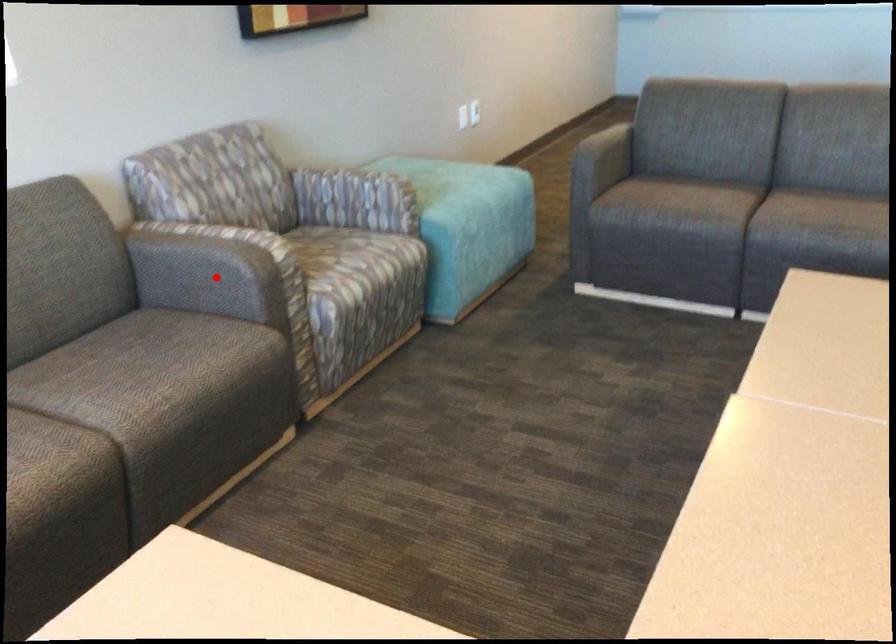
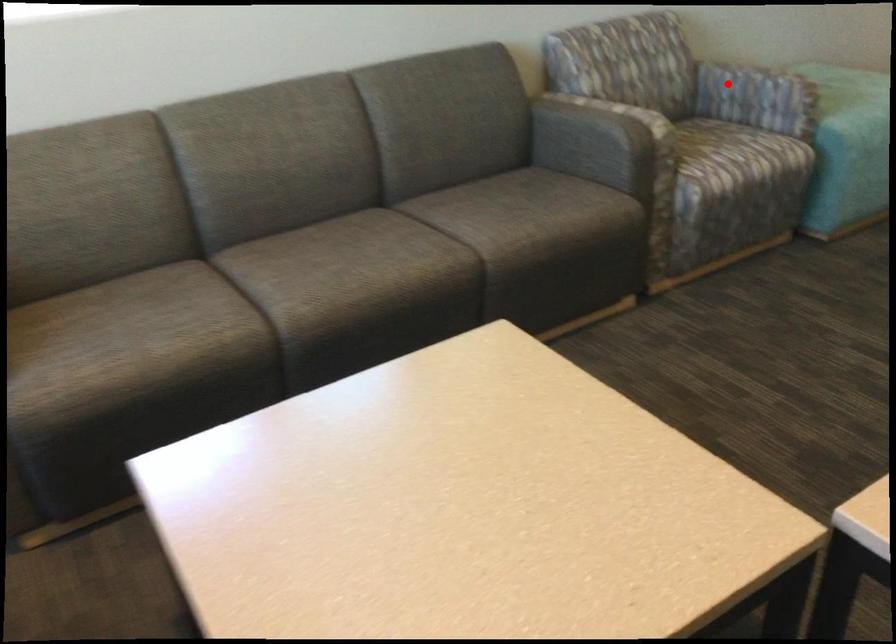
I am providing you with two images of the same scene from different viewpoints. A red point is marked on the first image and another point is marked on the second image. Do the highlighted points in image1 and image2 indicate the same real-world spot?

No